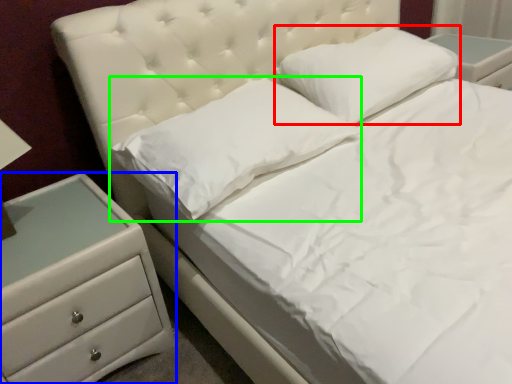
Question: Which object is the closest to the pillow (highlighted by a red box)? Choose among these: chest of drawers (highlighted by a blue box) or pillow (highlighted by a green box).

Choices:
 (A) chest of drawers
 (B) pillow

Answer: (B)